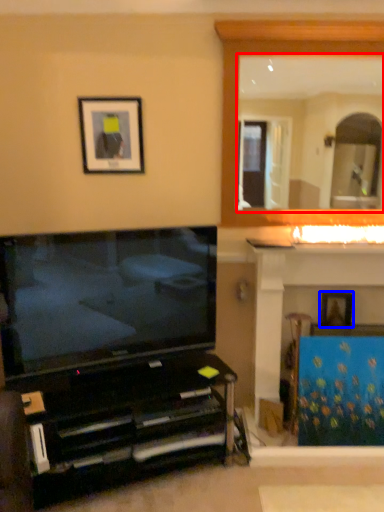
Question: Which point is further to the camera, mirror (highlighted by a red box) or picture frame (highlighted by a blue box)?

Choices:
 (A) mirror
 (B) picture frame

Answer: (B)